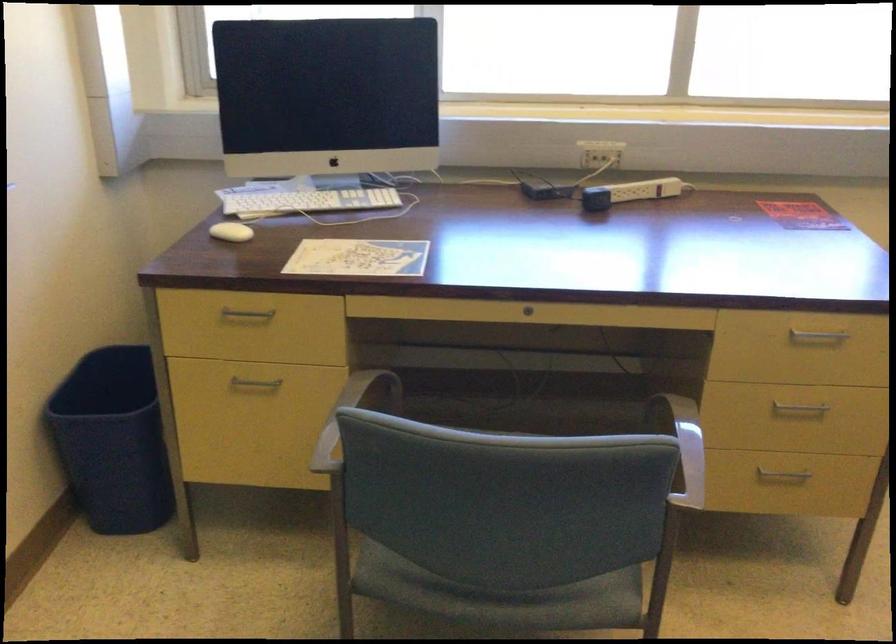
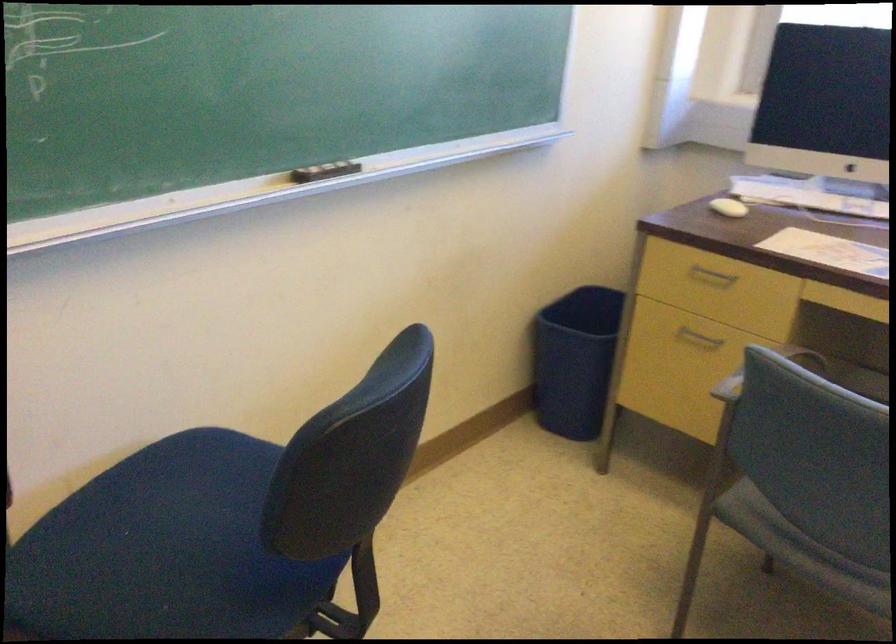
Find the pixel in the second image that matches (x=230, y=239) in the first image.

(728, 207)